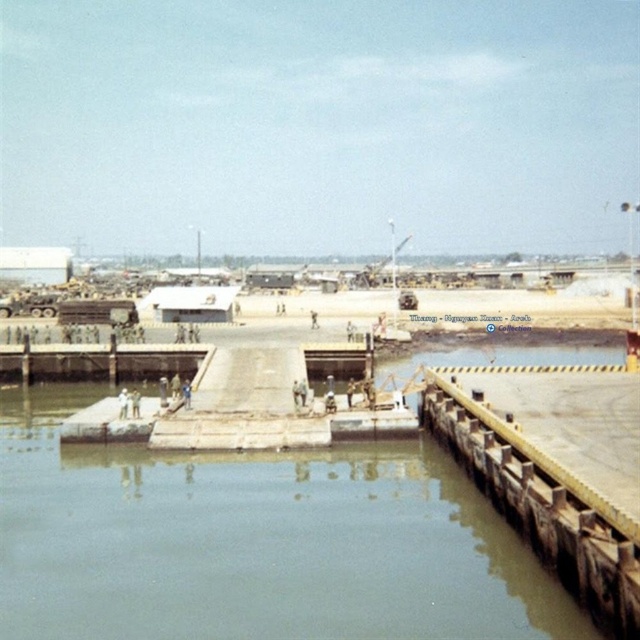
Question: Does clear water at center appear on the left side of wooden dock at lower right?

Choices:
 (A) no
 (B) yes

Answer: (B)

Question: Which point appears closest to the camera in this image?

Choices:
 (A) (456, 435)
 (B) (76, 502)

Answer: (B)

Question: Which point is farther from the camera taking this photo?

Choices:
 (A) (572, 502)
 (B) (349, 458)

Answer: (B)

Question: Considering the relative positions of clear water at center and wooden dock at lower right in the image provided, where is clear water at center located with respect to wooden dock at lower right?

Choices:
 (A) left
 (B) right

Answer: (A)

Question: Which point appears closest to the camera in this image?

Choices:
 (A) (497, 490)
 (B) (276, 512)

Answer: (A)

Question: Can you confirm if clear water at center is thinner than wooden dock at lower right?

Choices:
 (A) yes
 (B) no

Answer: (B)